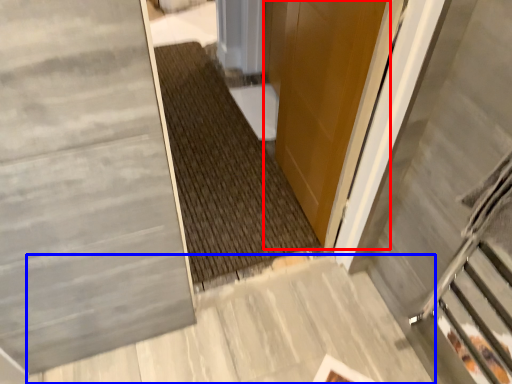
Question: Which of the following is the closest to the observer, door (highlighted by a red box) or concrete (highlighted by a blue box)?

Choices:
 (A) door
 (B) concrete

Answer: (A)